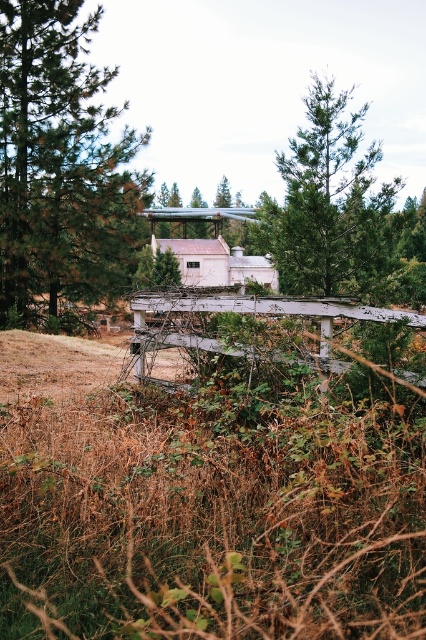
Is brown dry grass at lower left positioned behind green textured pine tree at left?

No, brown dry grass at lower left is closer to the viewer.

Does brown dry grass at lower left have a lesser width compared to green textured pine tree at left?

Indeed, brown dry grass at lower left has a lesser width compared to green textured pine tree at left.

Which is in front, point (189, 538) or point (42, 16)?

Point (189, 538) is in front.

Identify the location of brown dry grass at lower left. (210, 516).

Does point (359, 230) come behind point (337, 372)?

Yes, point (359, 230) is farther from viewer.

From the picture: Who is more forward, (307, 221) or (141, 364)?

Point (141, 364) is more forward.

Locate an element on the screen. Image resolution: width=426 pixels, height=640 pixels. green textured pine tree at upper center is located at coordinates (330, 205).

Locate an element on the screen. This screenshot has height=640, width=426. green textured pine tree at upper center is located at coordinates (330, 205).

Based on the photo, can you confirm if brown dry grass at lower left is bigger than green textured pine tree at upper center?

No, brown dry grass at lower left is not bigger than green textured pine tree at upper center.

Which is below, brown dry grass at lower left or green textured pine tree at upper center?

brown dry grass at lower left is lower down.

Is point (290, 428) positioned in front of point (393, 259)?

Yes, point (290, 428) is closer to viewer.

Identify the location of brown dry grass at lower left. The image size is (426, 640). (210, 516).